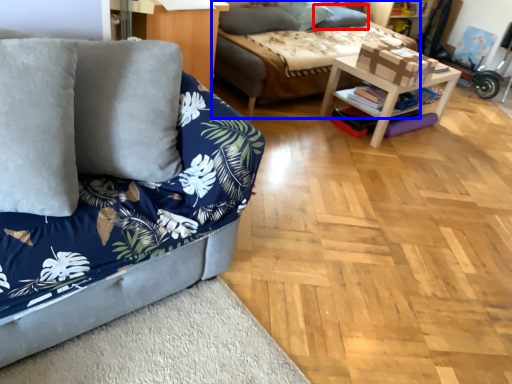
Question: Which object is closer to the camera taking this photo, pillow (highlighted by a red box) or studio couch (highlighted by a blue box)?

Choices:
 (A) pillow
 (B) studio couch

Answer: (B)